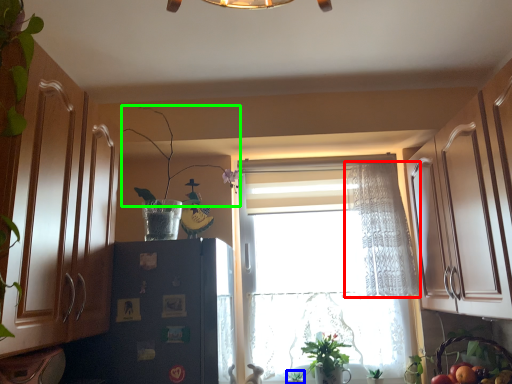
Question: Considering the real-world distances, which object is farthest from curtain (highlighted by a red box)? plant (highlighted by a blue box) or plant (highlighted by a green box)?

Choices:
 (A) plant
 (B) plant

Answer: (A)